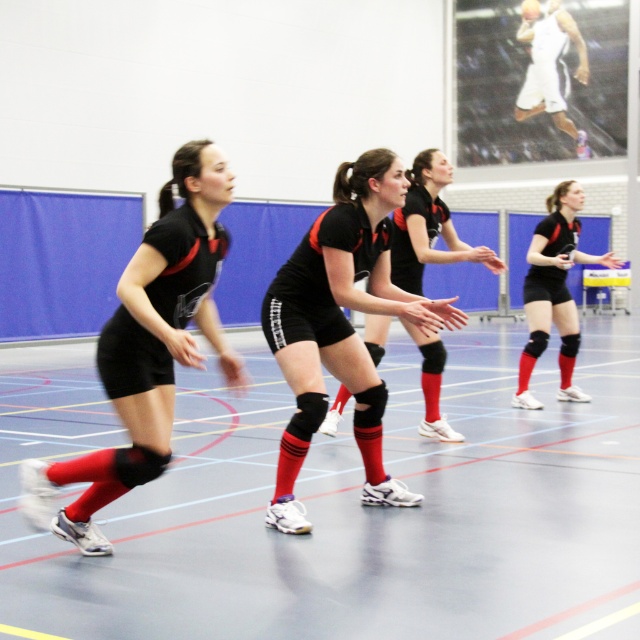
You are a sports equipment inspector checking the volleyball team members. You notice two items at the center of the court. Which item is located below the other? The items are the black matte shorts at center and the matte black knee pads at center.

The black matte shorts at center is positioned under matte black knee pads at center, so the shorts are below the knee pads.

You are a photographer positioned at the back of the sports hall. You want to take a photo of the matte black shorts at center and the matte black knee pads at center. Will the knee pads be visible in the photo if the shorts are in focus?

The matte black shorts at center is in front of matte black knee pads at center. If the shorts are in focus, the knee pads may appear slightly out of focus but still somewhat visible depending on the camera settings. However, since the shorts are directly in front, they might partially block the view of the knee pads.